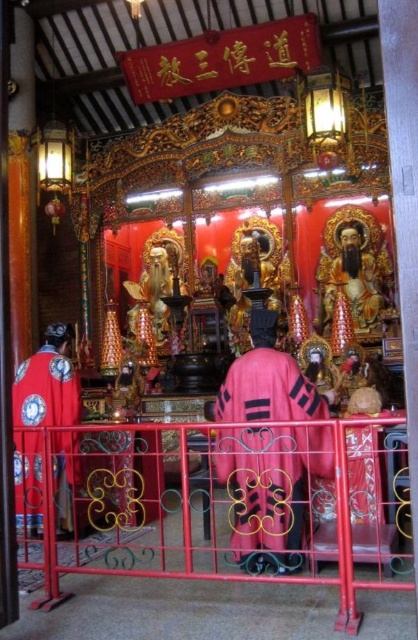
Who is positioned more to the right, metallic red railing at center or velvet pink robe at center?

velvet pink robe at center is more to the right.

Locate an element on the screen. The width and height of the screenshot is (418, 640). metallic red railing at center is located at coordinates (216, 506).

This screenshot has width=418, height=640. I want to click on metallic red railing at center, so click(216, 506).

Does point (280, 552) lie behind point (73, 472)?

No, it is not.

Does metallic red railing at center appear under velvet red robe at left?

No.

Describe the element at coordinates (216, 506) in the screenshot. The width and height of the screenshot is (418, 640). I see `metallic red railing at center` at that location.

This screenshot has height=640, width=418. I want to click on metallic red railing at center, so [216, 506].

Who is higher up, velvet pink robe at center or velvet red robe at left?

velvet red robe at left is above.

Which of these two, velvet pink robe at center or velvet red robe at left, stands taller?

Standing taller between the two is velvet red robe at left.

Is point (234, 420) positioned after point (56, 452)?

No, (234, 420) is in front of (56, 452).

The height and width of the screenshot is (640, 418). In order to click on velvet pink robe at center in this screenshot , I will do `click(270, 488)`.